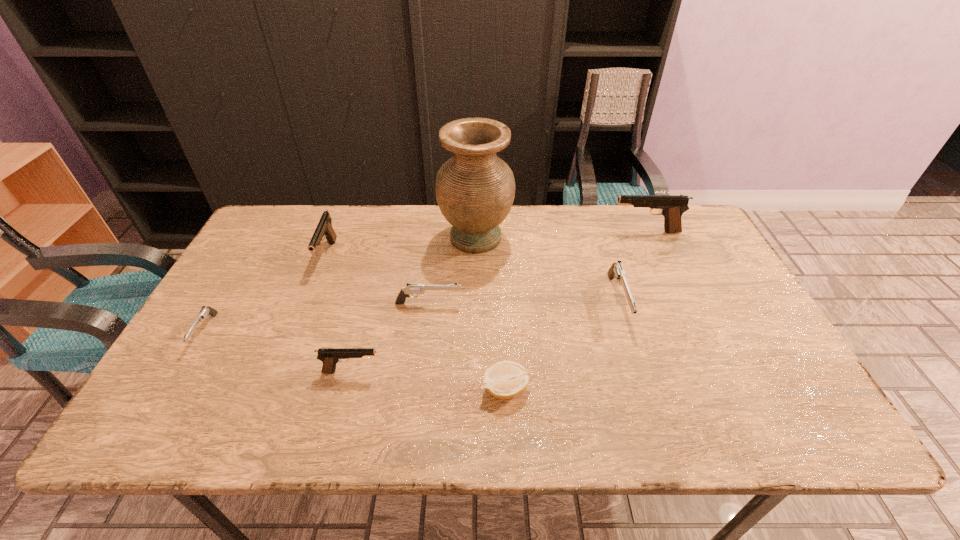
Select which black pistol is the second closest to the tallest object. Please provide its 2D coordinates. Your answer should be formatted as a tuple, i.e. [(x, y)], where the tuple contains the x and y coordinates of a point satisfying the conditions above.

[(324, 228)]

Select which black pistol appears as the second closest to the seventh object from right to left. Please provide its 2D coordinates. Your answer should be formatted as a tuple, i.e. [(x, y)], where the tuple contains the x and y coordinates of a point satisfying the conditions above.

[(672, 207)]

Find the location of a particular element. This screenshot has width=960, height=540. the second closest silver pistol to the tallest pistol is located at coordinates (412, 289).

Locate an element on the screen. The height and width of the screenshot is (540, 960). silver pistol that stands as the second closest to the second object from left to right is located at coordinates (205, 311).

What are the coordinates of `blank area in the image that satisfies the following two spatial constraints: 1. at the muzzle of the farthest black pistol; 2. at the muzzle of the seventh object from right to left` in the screenshot? It's located at (657, 255).

Where is `blank space that satisfies the following two spatial constraints: 1. at the muzzle of the yellow lemon; 2. on the right side of the leftmost black pistol`? The width and height of the screenshot is (960, 540). blank space that satisfies the following two spatial constraints: 1. at the muzzle of the yellow lemon; 2. on the right side of the leftmost black pistol is located at coordinates (276, 389).

In order to click on vacant point that satisfies the following two spatial constraints: 1. at the muzzle of the second tallest object; 2. on the front-facing side of the leftmost pistol in this screenshot , I will do `click(691, 332)`.

Image resolution: width=960 pixels, height=540 pixels. I want to click on blank area in the image that satisfies the following two spatial constraints: 1. on the front-facing side of the third pistol from right to left; 2. on the front-facing side of the leftmost silver pistol, so click(425, 332).

Locate an element on the screen. The height and width of the screenshot is (540, 960). free space that satisfies the following two spatial constraints: 1. on the front-facing side of the shortest pistol; 2. on the right side of the lemon is located at coordinates (172, 389).

This screenshot has width=960, height=540. What are the coordinates of `vacant space that satisfies the following two spatial constraints: 1. on the front-facing side of the rightmost silver pistol; 2. on the front-facing side of the second silver pistol from left to right` in the screenshot? It's located at (618, 303).